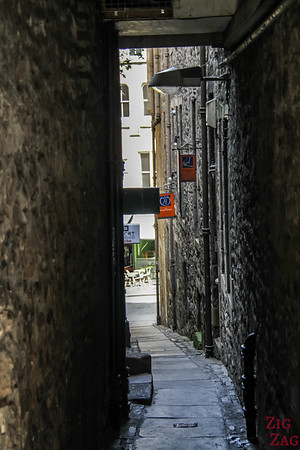
You are a GUI agent. You are given a task and a screenshot of the screen. Output one action in this format:
    pyautogui.click(x=<x>, y=<y>)
    Task: Click on the windows
    The image size is (300, 450).
    Given the screenshot: What is the action you would take?
    pyautogui.click(x=134, y=50), pyautogui.click(x=138, y=52), pyautogui.click(x=123, y=93), pyautogui.click(x=124, y=110), pyautogui.click(x=144, y=86), pyautogui.click(x=145, y=101), pyautogui.click(x=145, y=167), pyautogui.click(x=147, y=180)